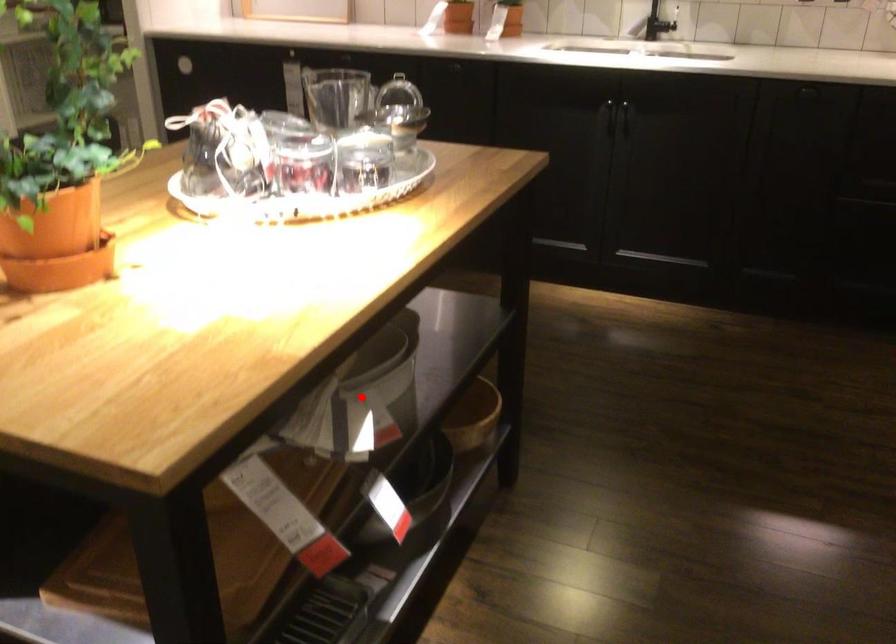
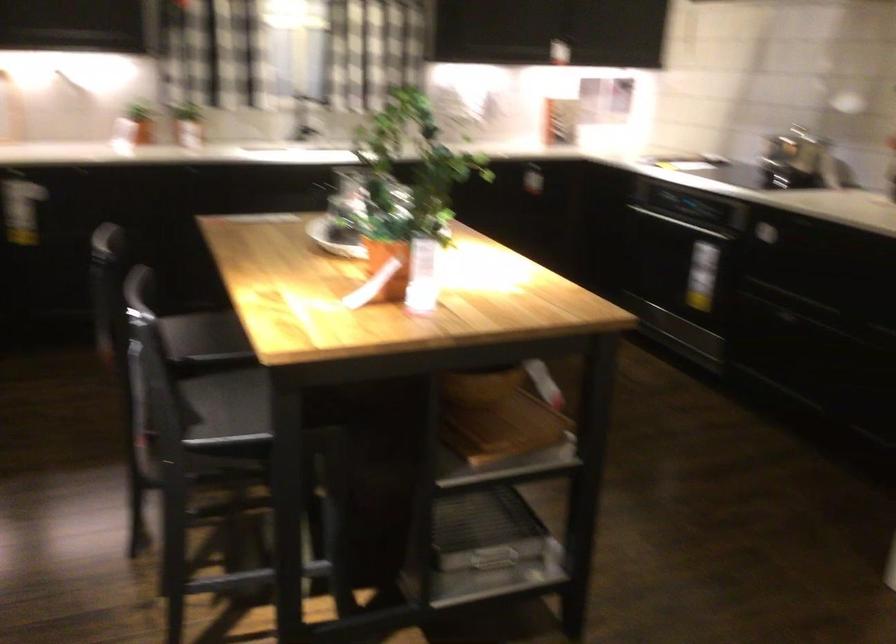
Question: I am providing you with two images of the same scene from different viewpoints. A red point is marked on the first image. Can you still see the location of the red point in image 2?

Choices:
 (A) Yes
 (B) No

Answer: (B)